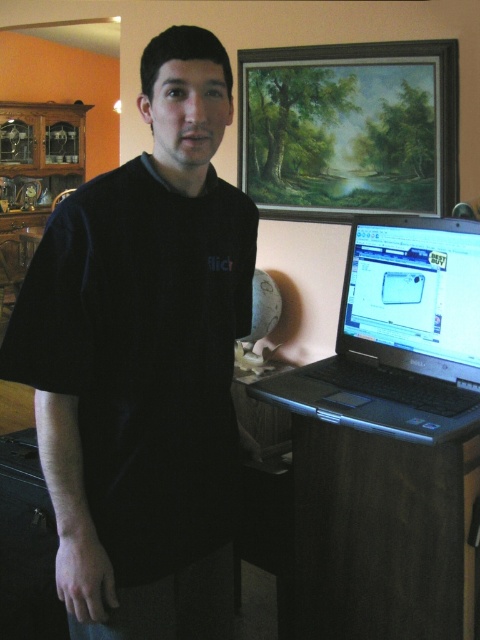
Between black cotton shirt at center and dark wood table at lower right, which one appears on the right side from the viewer's perspective?

Positioned to the right is dark wood table at lower right.

Is point (153, 52) more distant than point (355, 547)?

No, (153, 52) is in front of (355, 547).

Image resolution: width=480 pixels, height=640 pixels. What are the coordinates of `black cotton shirt at center` in the screenshot? It's located at (144, 364).

Between dark wood table at lower right and wooden oil painting at upper center, which one is positioned higher?

wooden oil painting at upper center is higher up.

You are a GUI agent. You are given a task and a screenshot of the screen. Output one action in this format:
    pyautogui.click(x=<x>, y=<y>)
    Task: Click on the dark wood table at lower right
    The height and width of the screenshot is (640, 480).
    Given the screenshot: What is the action you would take?
    pyautogui.click(x=361, y=532)

The height and width of the screenshot is (640, 480). Describe the element at coordinates (350, 128) in the screenshot. I see `wooden oil painting at upper center` at that location.

Who is taller, wooden oil painting at upper center or black plastic laptop at right?

Standing taller between the two is wooden oil painting at upper center.

Between point (384, 44) and point (469, 384), which one is positioned in front?

Positioned in front is point (469, 384).

Find the location of a particular element. This screenshot has width=480, height=640. wooden oil painting at upper center is located at coordinates 350,128.